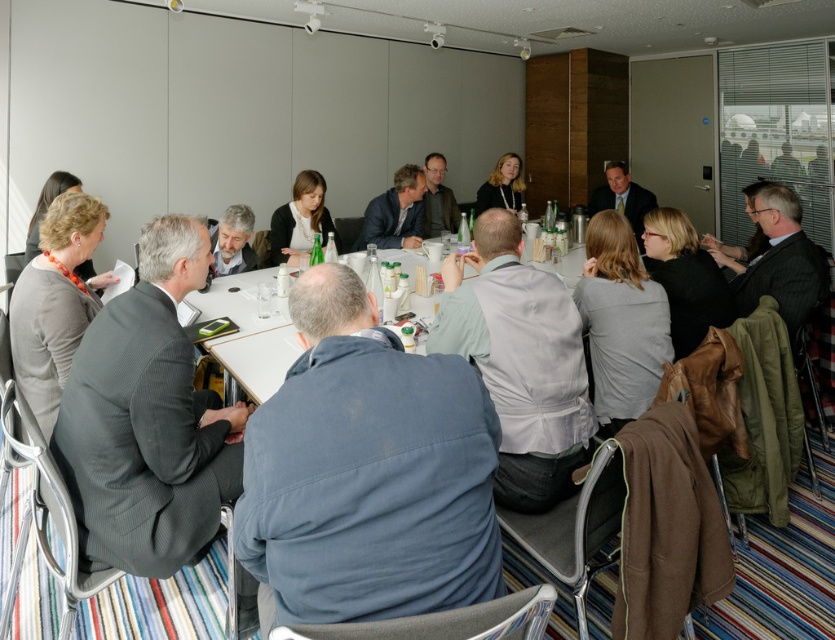
Based on the photo, you are organizing a presentation and need to arrange two shirts on a narrow shelf. The blue cotton shirt at center and the matte black shirt at center are both candidates. Based on their sizes, which shirt will require more horizontal space on the shelf?

The blue cotton shirt at center requires more horizontal space because its width surpasses that of the matte black shirt at center.

You are sitting at the table and want to pass a document to the person wearing the blue cotton shirt at center and the matte black jacket at upper center. Which direction should you move the document to reach both individuals?

The blue cotton shirt at center is positioned on the left side of matte black jacket at upper center, so you should move the document to the left towards the blue cotton shirt at center and then to the right towards the matte black jacket at upper center.